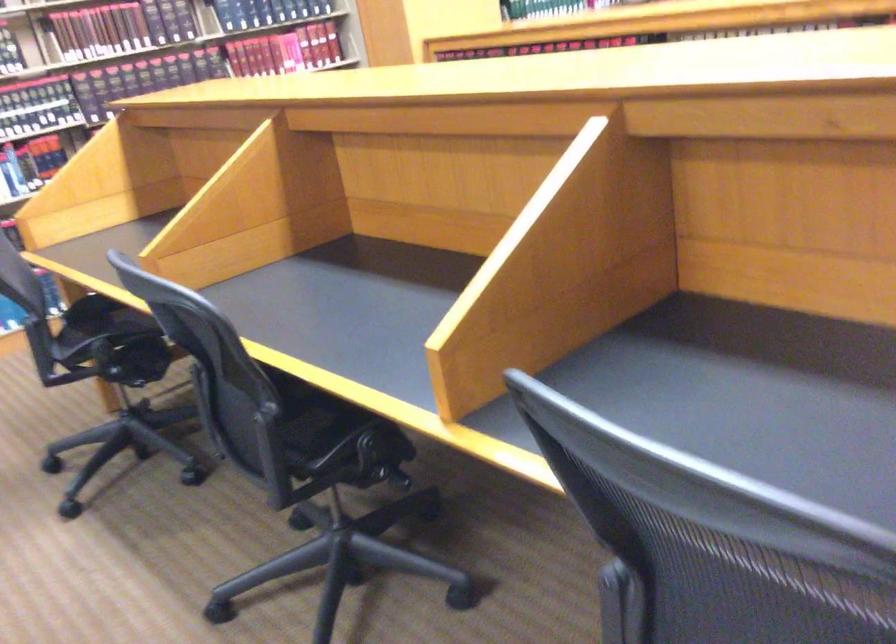
In order to click on chair sitting surface in this screenshot , I will do `click(296, 433)`.